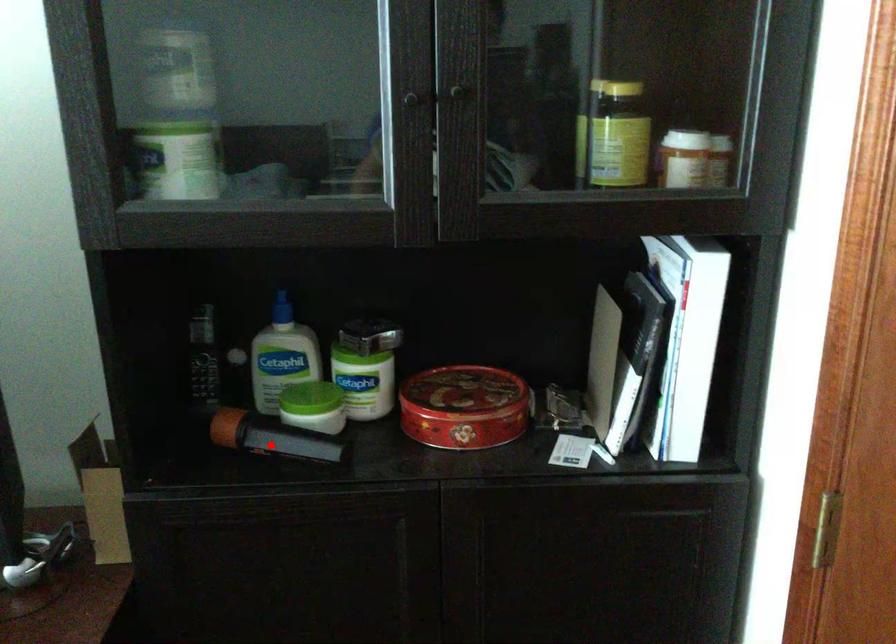
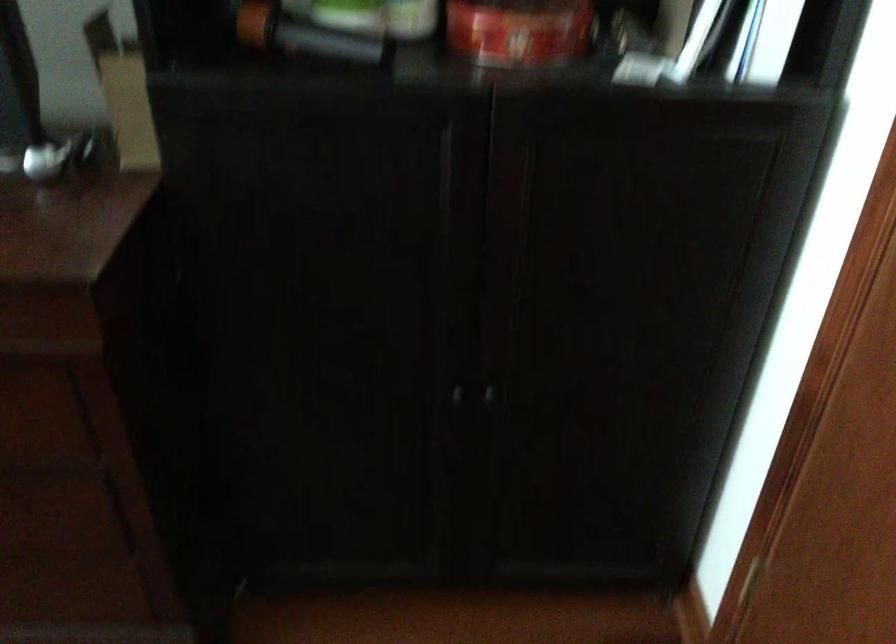
Locate, in the second image, the point that corresponds to the highlighted location in the first image.

(304, 35)